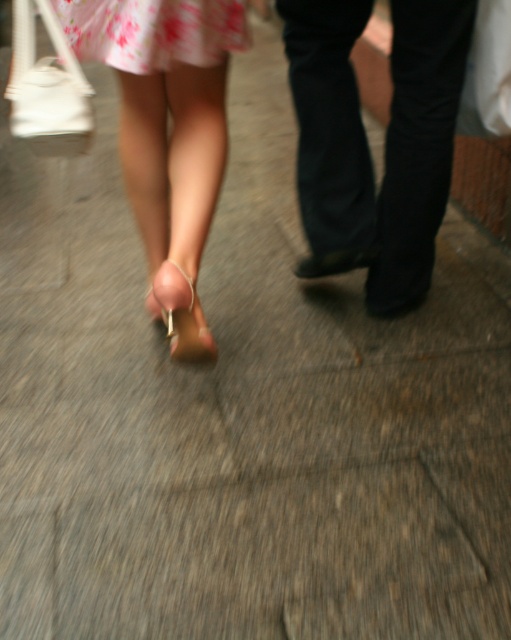
Is black leather pants at center closer to camera compared to black leather shoe at center?

Yes, black leather pants at center is in front of black leather shoe at center.

Image resolution: width=511 pixels, height=640 pixels. I want to click on black leather pants at center, so click(385, 134).

The image size is (511, 640). Describe the element at coordinates (385, 134) in the screenshot. I see `black leather pants at center` at that location.

Identify the location of black leather pants at center. click(385, 134).

Who is positioned more to the right, pink floral fabric dress at upper left or black leather shoe at center?

black leather shoe at center

From the picture: Measure the distance between point (103, 13) and camera.

Point (103, 13) is 4.31 feet away from camera.

Describe the element at coordinates (153, 32) in the screenshot. I see `pink floral fabric dress at upper left` at that location.

Image resolution: width=511 pixels, height=640 pixels. In order to click on pink floral fabric dress at upper left in this screenshot , I will do `click(153, 32)`.

Who is higher up, pink floral fabric dress at upper left or satin beige sandal at lower center?

pink floral fabric dress at upper left is higher up.

In the scene shown: Can you confirm if pink floral fabric dress at upper left is taller than satin beige sandal at lower center?

No, pink floral fabric dress at upper left is not taller than satin beige sandal at lower center.

Who is more forward, (101, 13) or (169, 260)?

Point (101, 13) is in front.

You are a GUI agent. You are given a task and a screenshot of the screen. Output one action in this format:
    pyautogui.click(x=<x>, y=<y>)
    Task: Click on the pink floral fabric dress at upper left
    The height and width of the screenshot is (640, 511).
    Given the screenshot: What is the action you would take?
    pyautogui.click(x=153, y=32)